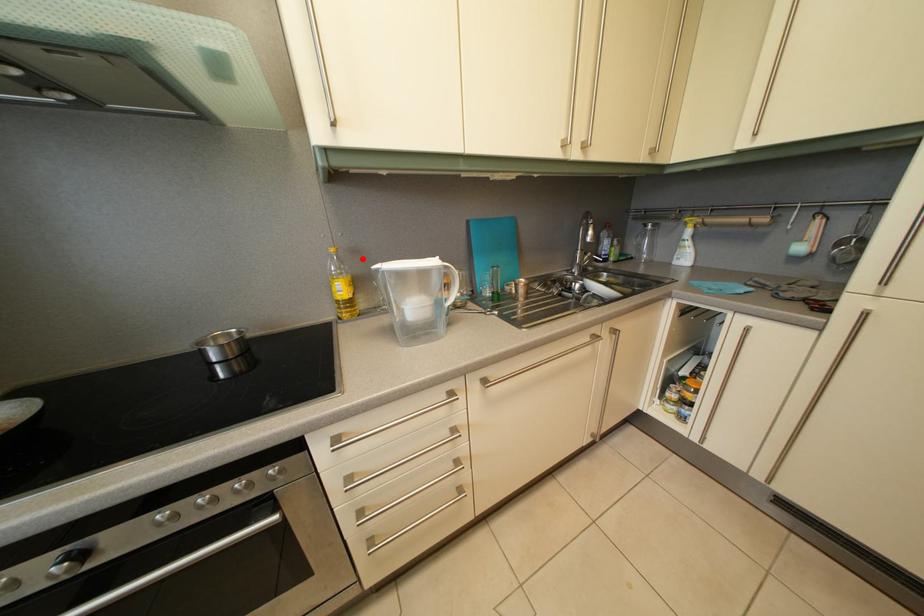
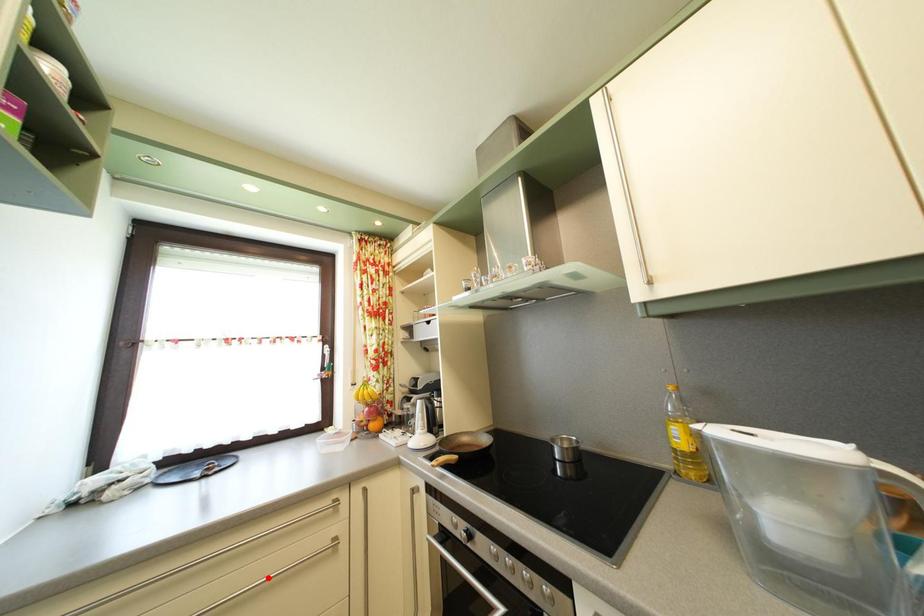
I am providing you with two images of the same scene from different viewpoints. A red point is marked on the first image and another point is marked on the second image. Is the red point in image1 aligned with the point shown in image2?

No